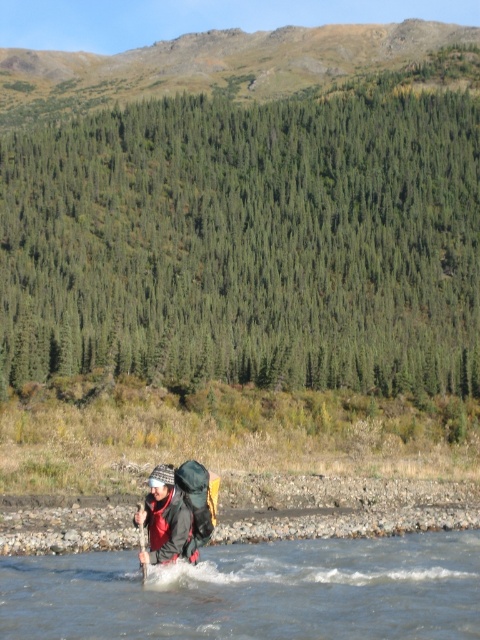
Which of these two, matte black backpack at center or wooden paddle at center, stands taller?

With more height is wooden paddle at center.

Between point (147, 512) and point (144, 541), which one is positioned in front?

Point (147, 512) is in front.

Which is behind, point (168, 541) or point (144, 548)?

Point (144, 548)

Locate an element on the screen. This screenshot has width=480, height=640. matte black backpack at center is located at coordinates (167, 518).

Can you confirm if clear water at center is positioned below wooden paddle at center?

Actually, clear water at center is above wooden paddle at center.

Which of these two, clear water at center or wooden paddle at center, stands shorter?

clear water at center is shorter.

Between point (187, 573) and point (143, 545), which one is positioned behind?

Positioned behind is point (187, 573).

Identify the location of clear water at center. (252, 592).

Between clear water at center and matte black backpack at center, which one appears on the left side from the viewer's perspective?

From the viewer's perspective, matte black backpack at center appears more on the left side.

This screenshot has height=640, width=480. Describe the element at coordinates (252, 592) in the screenshot. I see `clear water at center` at that location.

You are a GUI agent. You are given a task and a screenshot of the screen. Output one action in this format:
    pyautogui.click(x=<x>, y=<y>)
    Task: Click on the clear water at center
    The image size is (480, 640).
    Given the screenshot: What is the action you would take?
    pyautogui.click(x=252, y=592)